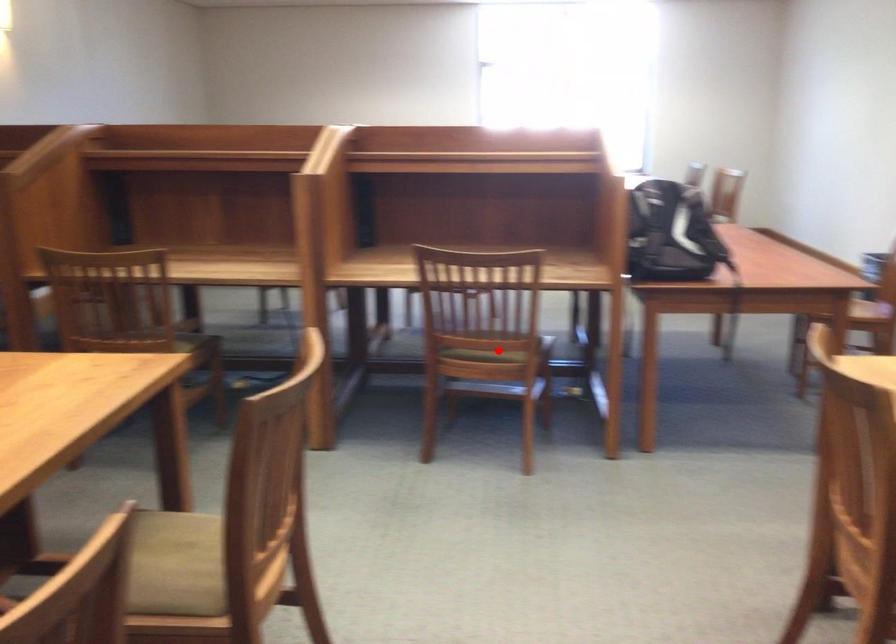
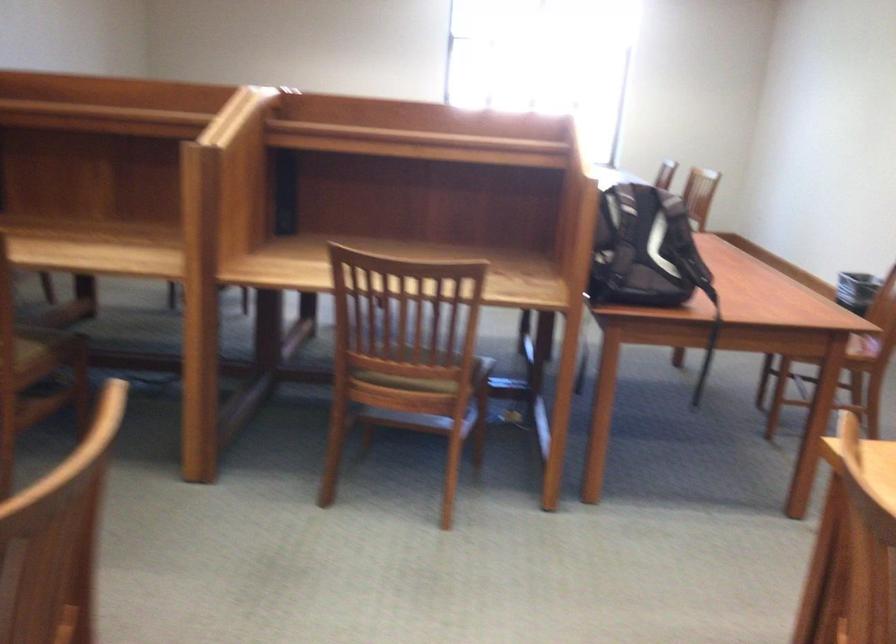
Question: I am providing you with two images of the same scene from different viewpoints. Image1 has a red point marked. In image2, the corresponding 3D location appears at what relative position? Reply with the corresponding letter.

Choices:
 (A) Closer
 (B) Farther

Answer: (A)